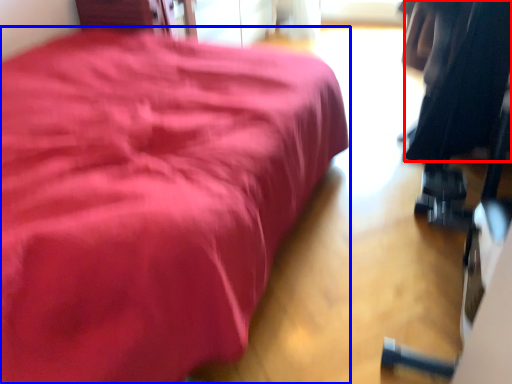
Question: Which of the following is the closest to the observer, clothing (highlighted by a red box) or furniture (highlighted by a blue box)?

Choices:
 (A) clothing
 (B) furniture

Answer: (B)